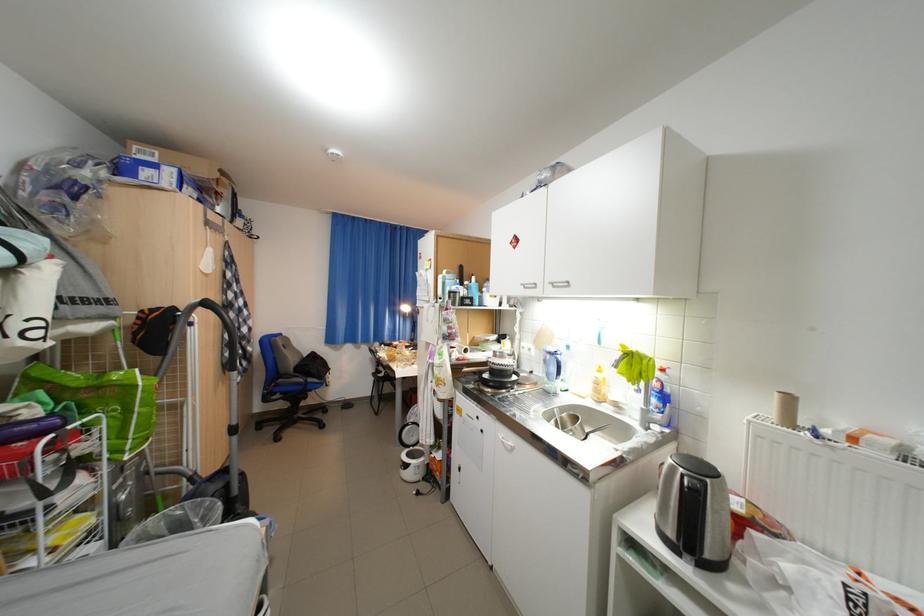
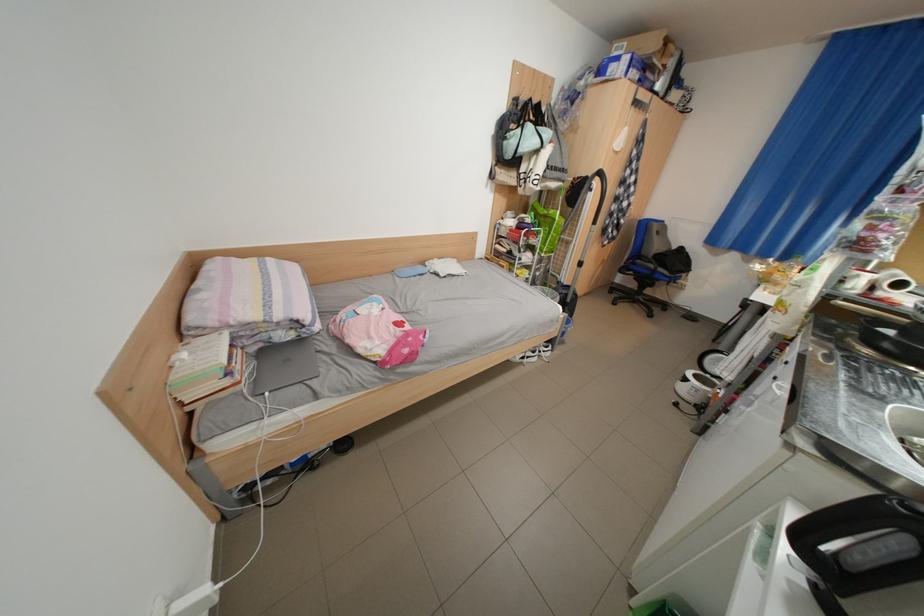
Where in the second image is the point corresponding to point (419, 456) from the first image?

(708, 377)